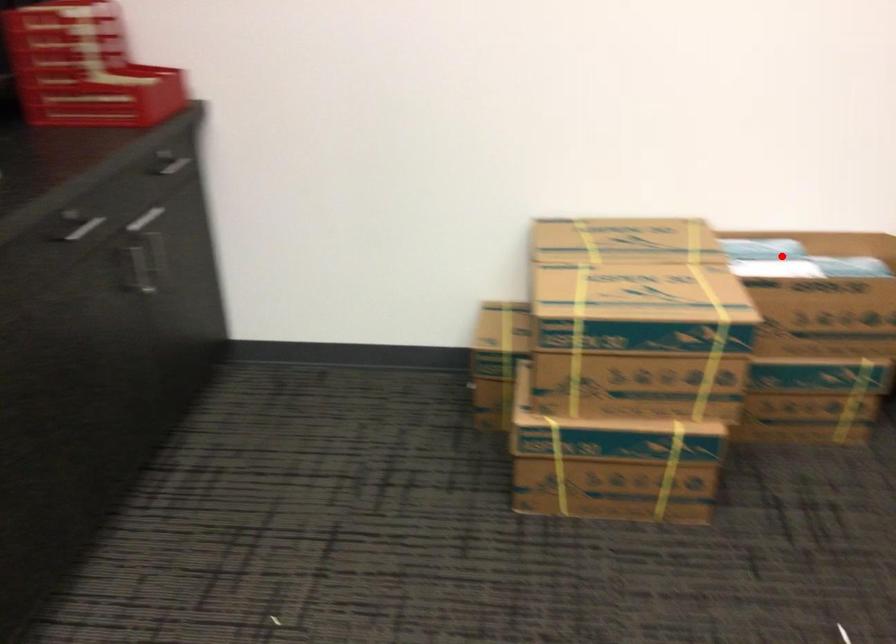
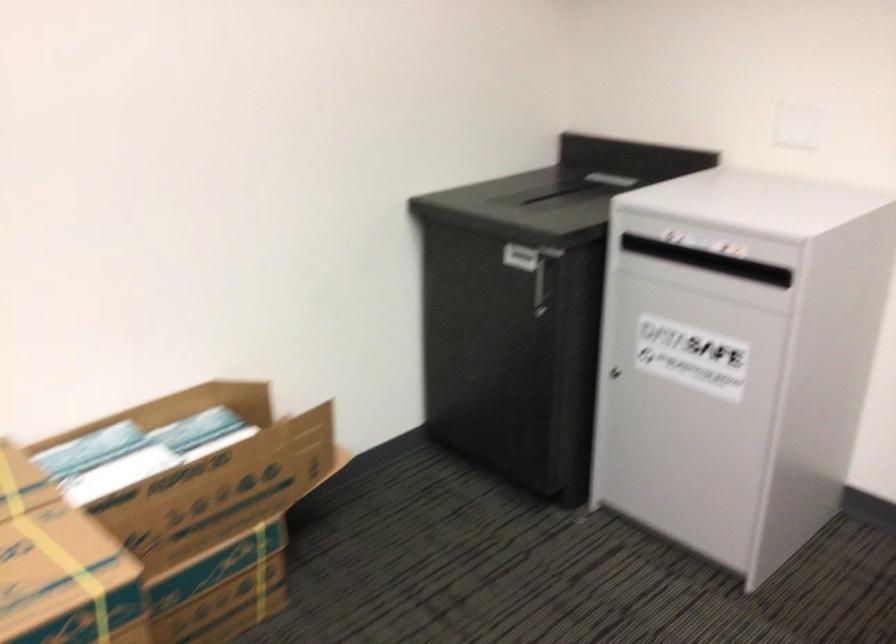
In the second image, find the point that corresponds to the highlighted location in the first image.

(136, 451)